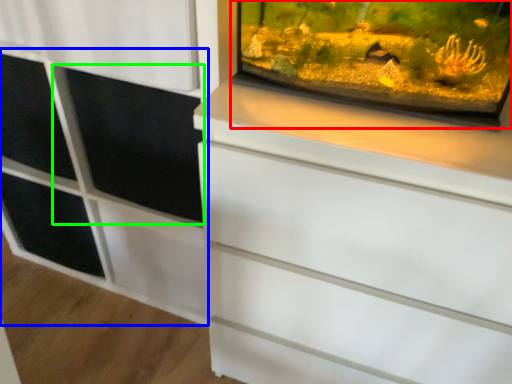
Question: Considering the real-world distances, which object is closest to glass box (highlighted by a red box)? side cabinet (highlighted by a blue box) or screen door (highlighted by a green box).

Choices:
 (A) side cabinet
 (B) screen door

Answer: (B)